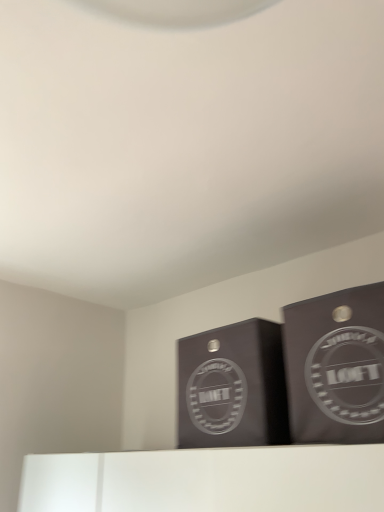
Question: Considering the positions of matte black box at center, which appears as the second cardboard box when viewed from the right, and matte black cardboard box at upper right, the 2th cardboard box viewed from the left, in the image, is matte black box at center, which appears as the second cardboard box when viewed from the right, taller or shorter than matte black cardboard box at upper right, the 2th cardboard box viewed from the left,?

Choices:
 (A) short
 (B) tall

Answer: (A)

Question: Does point (274, 432) appear closer or farther from the camera than point (297, 352)?

Choices:
 (A) farther
 (B) closer

Answer: (A)

Question: Looking at the image, does matte black box at center, the 1th cardboard box positioned from the left, seem bigger or smaller compared to matte black cardboard box at upper right, the 2th cardboard box viewed from the left?

Choices:
 (A) big
 (B) small

Answer: (A)

Question: Choose the correct answer: Is matte black cardboard box at upper right, which is the 1th cardboard box in right-to-left order, inside matte black box at center, the 1th cardboard box positioned from the left, or outside it?

Choices:
 (A) inside
 (B) outside

Answer: (B)

Question: Considering the positions of matte black cardboard box at upper right, which is the 1th cardboard box in right-to-left order, and matte black box at center, which appears as the second cardboard box when viewed from the right, in the image, is matte black cardboard box at upper right, which is the 1th cardboard box in right-to-left order, bigger or smaller than matte black box at center, which appears as the second cardboard box when viewed from the right,?

Choices:
 (A) big
 (B) small

Answer: (B)

Question: From their relative heights in the image, would you say matte black cardboard box at upper right, the 2th cardboard box viewed from the left, is taller or shorter than matte black box at center, the 1th cardboard box positioned from the left?

Choices:
 (A) tall
 (B) short

Answer: (A)

Question: Is matte black cardboard box at upper right, which is the 1th cardboard box in right-to-left order, to the left or to the right of matte black box at center, which appears as the second cardboard box when viewed from the right, in the image?

Choices:
 (A) left
 (B) right

Answer: (B)